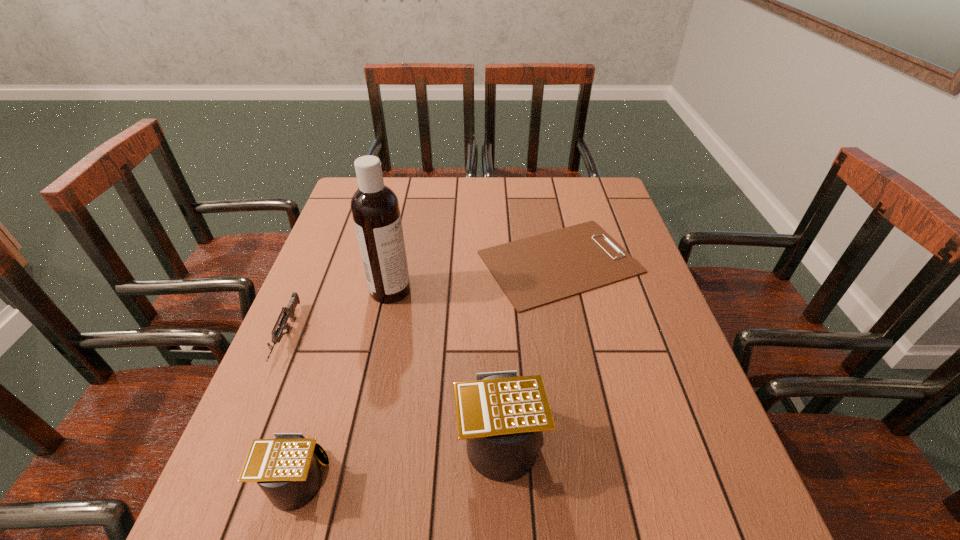
Please point out where to position a new calculator on the right to maintain spacing. Please provide its 2D coordinates. Your answer should be formatted as a tuple, i.e. [(x, y)], where the tuple contains the x and y coordinates of a point satisfying the conditions above.

[(676, 400)]